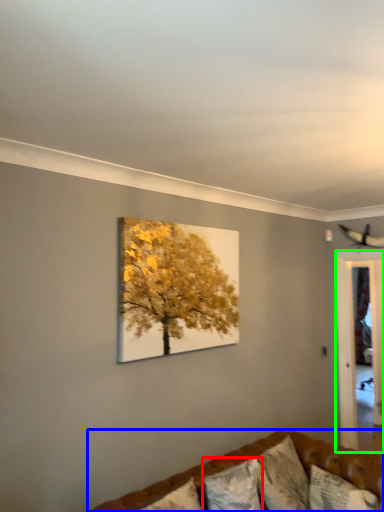
Question: Which is farther away from pillow (highlighted by a red box)? studio couch (highlighted by a blue box) or glass door (highlighted by a green box)?

Choices:
 (A) studio couch
 (B) glass door

Answer: (B)